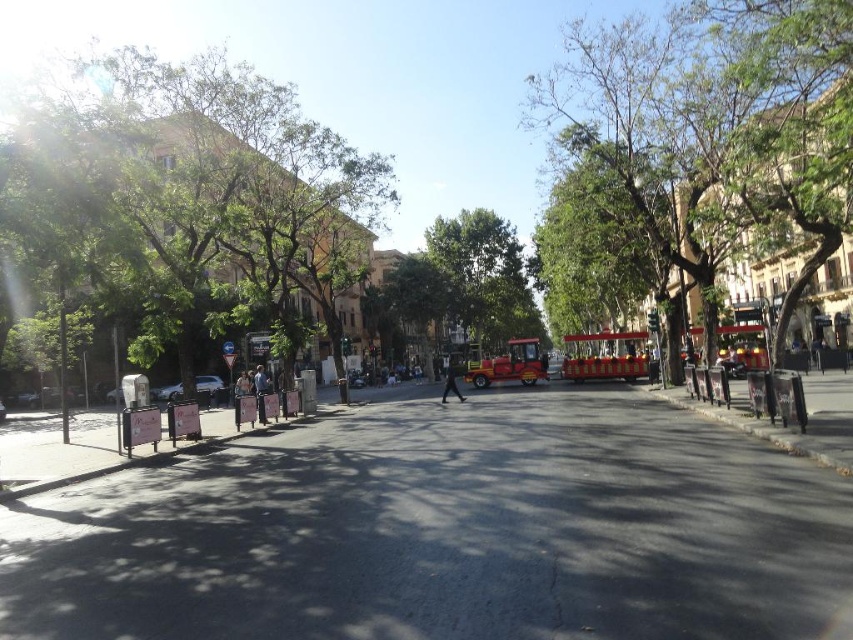
Question: Among these objects, which one is nearest to the camera?

Choices:
 (A) asphalt at center
 (B) light blue denim jacket at center
 (C) metallic red trolley at center

Answer: (A)

Question: Does green leafy tree at center have a lesser width compared to black matte person at center?

Choices:
 (A) yes
 (B) no

Answer: (B)

Question: Based on their relative distances, which object is farther from the red polished bus at center?

Choices:
 (A) metallic red trolley at center
 (B) black matte person at center
 (C) green leafy tree at left

Answer: (C)

Question: Does green leafy tree at center have a lesser width compared to light blue jeans at center?

Choices:
 (A) no
 (B) yes

Answer: (A)

Question: Which point is closer to the camera taking this photo?

Choices:
 (A) (492, 372)
 (B) (194, 384)
 (C) (257, 380)

Answer: (B)

Question: Can you confirm if black matte person at center is wider than light blue jeans at center?

Choices:
 (A) yes
 (B) no

Answer: (B)